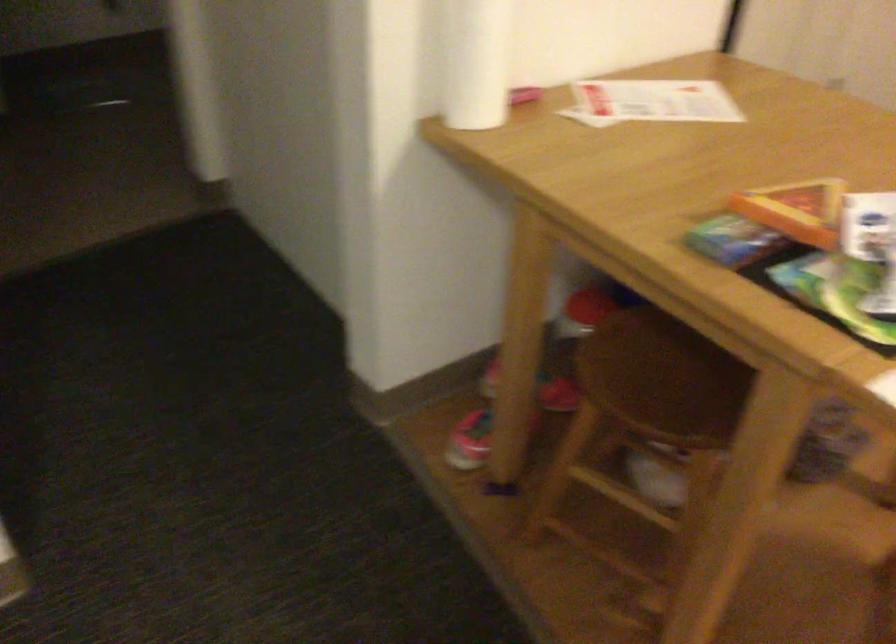
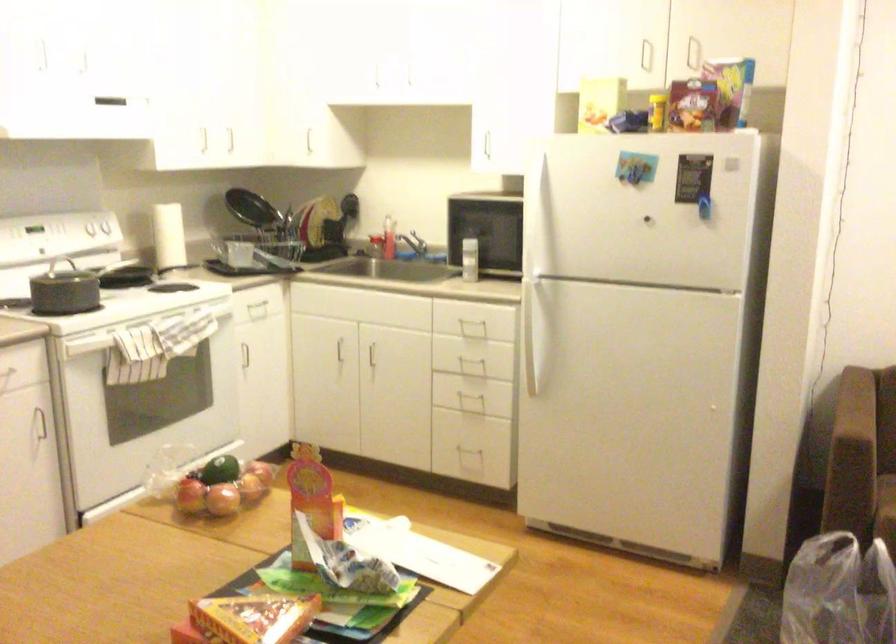
Where in the second image is the point corresponding to point (741, 257) from the first image?

(253, 617)